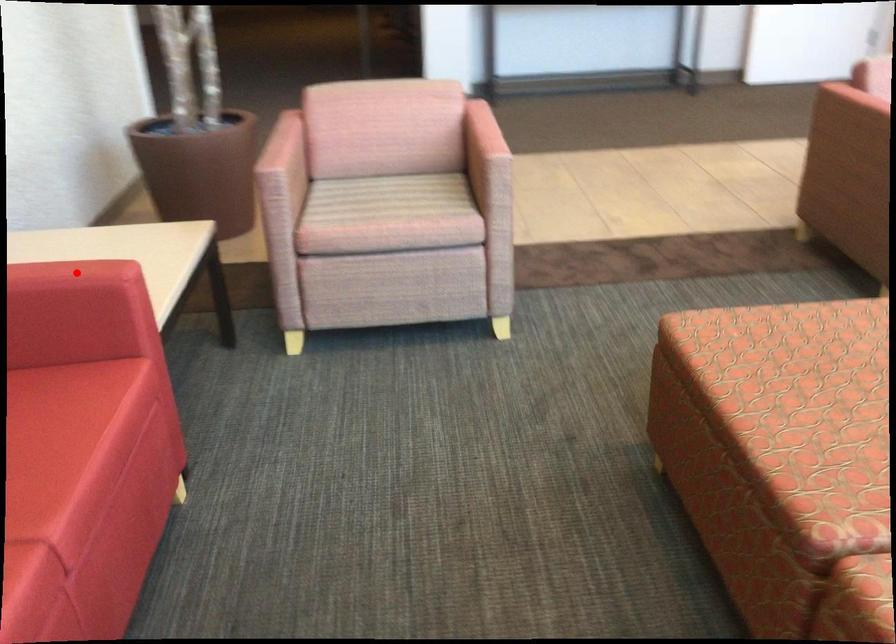
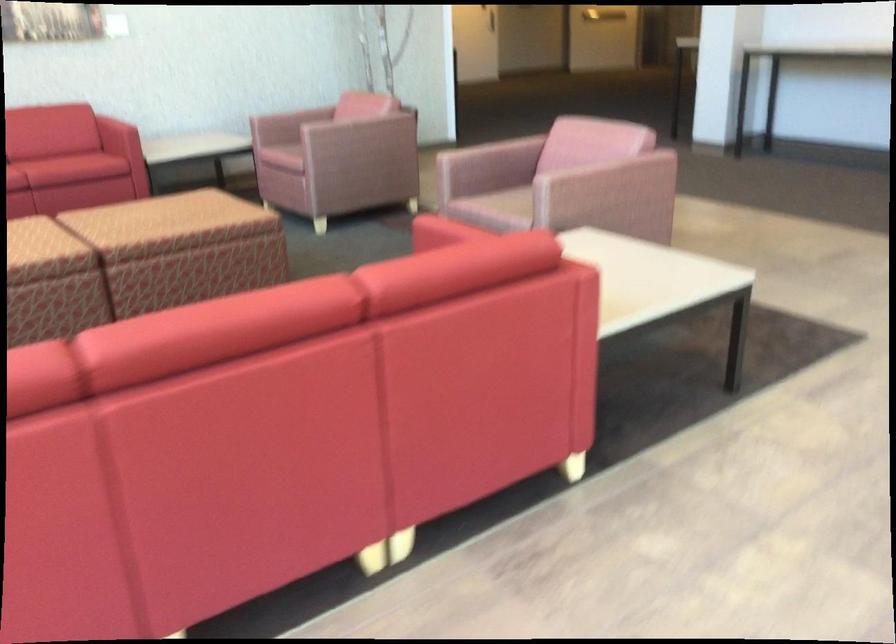
Question: I am providing you with two images of the same scene from different viewpoints. A red point is marked on the first image. At the location where the point appears in image 1, is it still visible in image 2?

Choices:
 (A) Yes
 (B) No

Answer: (B)